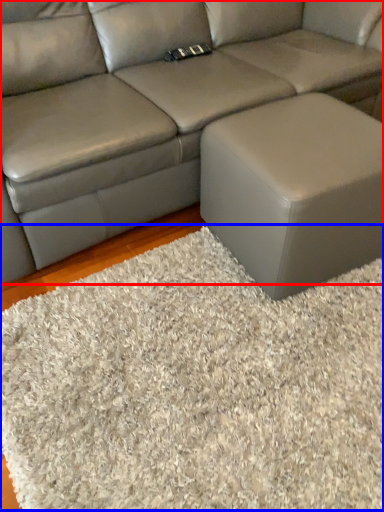
Question: Which point is further to the camera, studio couch (highlighted by a red box) or mat (highlighted by a blue box)?

Choices:
 (A) studio couch
 (B) mat

Answer: (A)